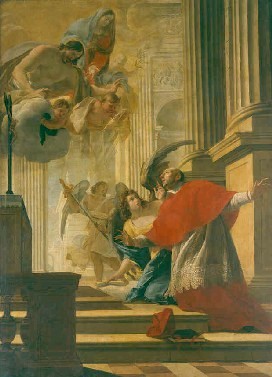
Identify the location of flooring. The image size is (272, 377). (181, 368).